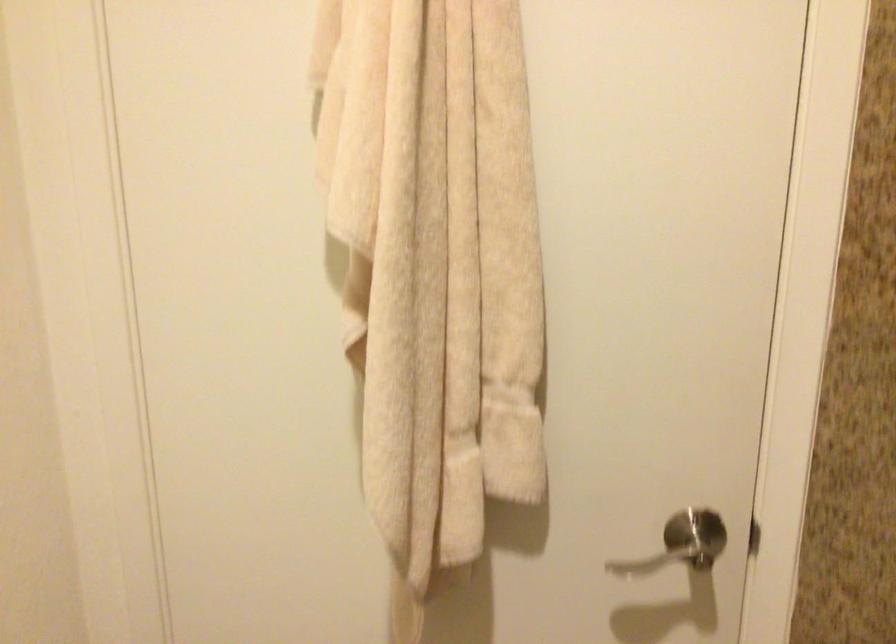
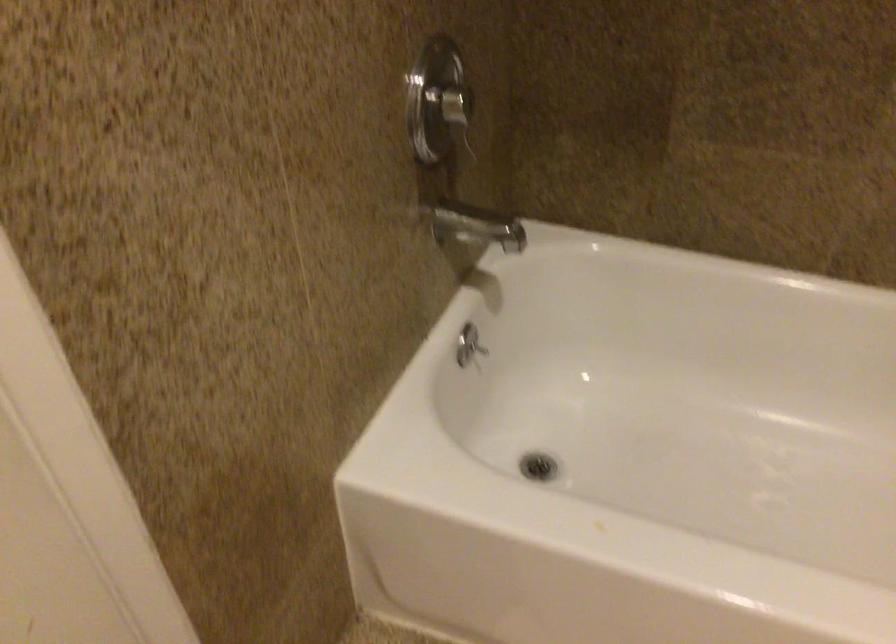
The first image is from the beginning of the video and the second image is from the end. How did the camera likely rotate when shooting the video?

The camera rotated toward right-down.